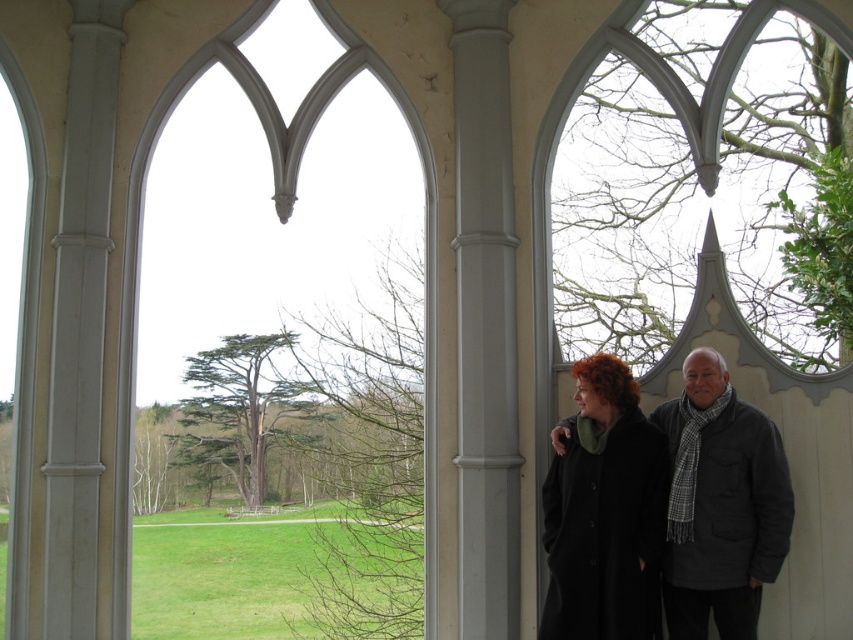
You are a fashion designer observing the scene. You need to determine which item of clothing is bigger between the black wool coat at center and the dark gray wool scarf at right. Which one is larger?

The black wool coat at center is larger than the dark gray wool scarf at right.

Where is the black wool coat at center located in the image?

The black wool coat at center is located at point [604,512].

You are standing inside the Gothic structure and want to take a photo of the dark gray wool scarf at right without the gray smooth column at center blocking the view. Is this possible given their positions?

The gray smooth column at center is above the dark gray wool scarf at right, so if you position yourself below the column, you can capture the scarf without the column obstructing the view.